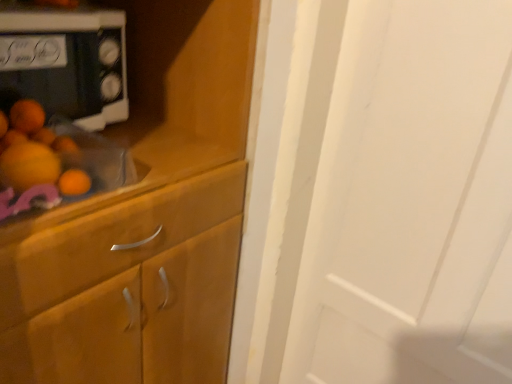
The image size is (512, 384). Describe the element at coordinates (67, 63) in the screenshot. I see `white glossy microwave at upper left` at that location.

The image size is (512, 384). I want to click on white glossy microwave at upper left, so click(67, 63).

What do you see at coordinates (145, 219) in the screenshot?
I see `wooden cabinet at left` at bounding box center [145, 219].

Identify the location of wooden cabinet at left. The height and width of the screenshot is (384, 512). (145, 219).

This screenshot has height=384, width=512. I want to click on white glossy microwave at upper left, so click(x=67, y=63).

Considering the positions of objects white glossy microwave at upper left and wooden cabinet at left in the image provided, who is more to the left, white glossy microwave at upper left or wooden cabinet at left?

wooden cabinet at left is more to the left.

Is white glossy microwave at upper left positioned behind wooden cabinet at left?

Yes, the depth of white glossy microwave at upper left is greater than that of wooden cabinet at left.

Considering the points (78, 88) and (6, 339), which point is in front, point (78, 88) or point (6, 339)?

Point (6, 339)

From the image's perspective, is white glossy microwave at upper left located above or below wooden cabinet at left?

From the image's perspective, white glossy microwave at upper left appears above wooden cabinet at left.

From a real-world perspective, is white glossy microwave at upper left below wooden cabinet at left?

No, from a real-world perspective, white glossy microwave at upper left is not below wooden cabinet at left.

Looking at their sizes, would you say white glossy microwave at upper left is wider or thinner than wooden cabinet at left?

In the image, white glossy microwave at upper left appears to be more narrow than wooden cabinet at left.

Is white glossy microwave at upper left taller or shorter than wooden cabinet at left?

In the image, white glossy microwave at upper left appears to be shorter than wooden cabinet at left.

Does white glossy microwave at upper left have a smaller size compared to wooden cabinet at left?

Indeed, white glossy microwave at upper left has a smaller size compared to wooden cabinet at left.

Would you say white glossy microwave at upper left is inside or outside wooden cabinet at left?

white glossy microwave at upper left cannot be found inside wooden cabinet at left.

Is white glossy microwave at upper left next to wooden cabinet at left?

No.

Is white glossy microwave at upper left aimed at wooden cabinet at left?

No.

Can you tell me how much white glossy microwave at upper left and wooden cabinet at left differ in facing direction?

They differ by 4.08 degrees in their facing directions.

This screenshot has height=384, width=512. In order to click on cabinetry that is below the white glossy microwave at upper left (from the image's perspective) in this screenshot , I will do `click(145, 219)`.

Which is more to the left, wooden cabinet at left or white glossy microwave at upper left?

From the viewer's perspective, wooden cabinet at left appears more on the left side.

Which is behind, wooden cabinet at left or white glossy microwave at upper left?

white glossy microwave at upper left is behind.

Is point (15, 329) farther from camera compared to point (12, 87)?

No, (15, 329) is closer to viewer.

From the image's perspective, which one is positioned lower, wooden cabinet at left or white glossy microwave at upper left?

wooden cabinet at left.

From a real-world perspective, is wooden cabinet at left physically located above or below white glossy microwave at upper left?

From a real-world perspective, wooden cabinet at left is physically below white glossy microwave at upper left.

Which of these two, wooden cabinet at left or white glossy microwave at upper left, is thinner?

white glossy microwave at upper left is thinner.

From the picture: Which of these two, wooden cabinet at left or white glossy microwave at upper left, stands taller?

Standing taller between the two is wooden cabinet at left.

Is wooden cabinet at left smaller than white glossy microwave at upper left?

No, wooden cabinet at left is not smaller than white glossy microwave at upper left.

Is white glossy microwave at upper left located within wooden cabinet at left?

No.

Are wooden cabinet at left and white glossy microwave at upper left beside each other?

No, wooden cabinet at left is not next to white glossy microwave at upper left.

Is wooden cabinet at left aimed at white glossy microwave at upper left?

No, wooden cabinet at left does not turn towards white glossy microwave at upper left.

This screenshot has width=512, height=384. Identify the location of cabinetry below the white glossy microwave at upper left (from the image's perspective). (145, 219).

At what (x,y) coordinates should I click in order to perform the action: click on home appliance on the right of wooden cabinet at left. Please return your answer as a coordinate pair (x, y). The image size is (512, 384). Looking at the image, I should click on (67, 63).

Where is `cabinetry in front of the white glossy microwave at upper left`? cabinetry in front of the white glossy microwave at upper left is located at coordinates (145, 219).